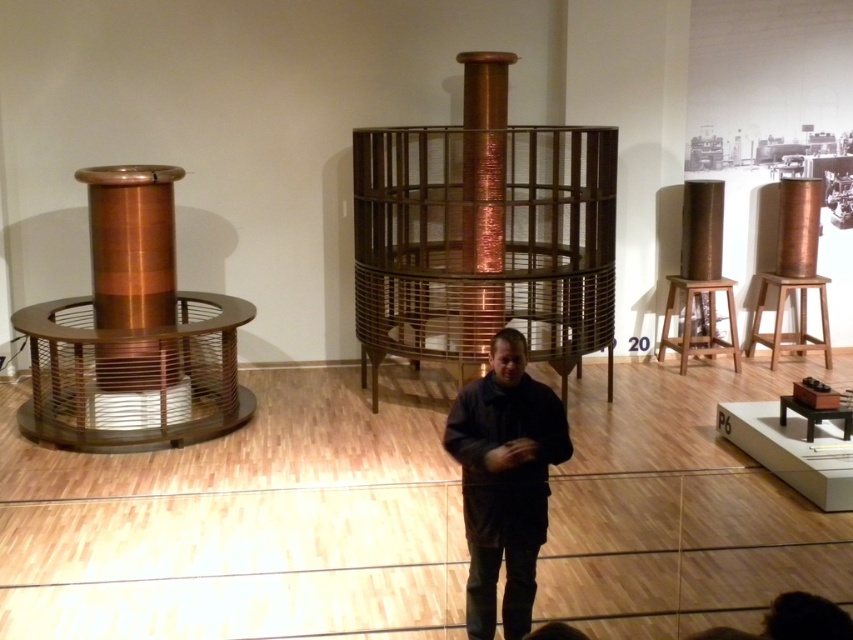
Based on the photo, you are a visitor at the exhibition and want to sit down to rest. There is a dark matte jacket at center and a wooden stool at right in the scene. Which object is closer to the entrance if the entrance is to the right side of the image?

The wooden stool at right is closer to the entrance because it is positioned to the right side of the dark matte jacket at center, and the entrance is also on the right side of the image.

In the scene shown: You are an event planner setting up a presentation area in the exhibition space. You need to place a 1.2 meter wide screen between the dark matte jacket at center and the light brown wooden stool at right. Can the space between them accommodate the screen?

The dark matte jacket at center is narrower than the light brown wooden stool at right. However, the exact distance between them isn

You are standing at the entrance of the exhibition hall and want to take a photo of the central coil. The camera you are using has a focal length of 50mm and a sensor size of 24mm x 36mm. If the point corresponding to the central coil is at coordinate point (514, 460), which is 3.38 meters away from the camera, what is the approximate distance in meters between you and the central coil?

The distance between you and the central coil is approximately 3.38 meters, as the point corresponding to the central coil is 3.38 meters away from the camera, which is your position.